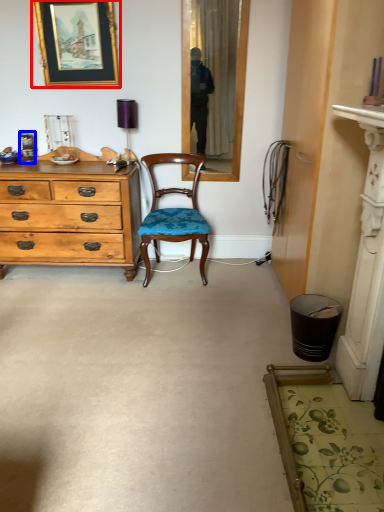
Question: Which object is further to the camera taking this photo, picture frame (highlighted by a red box) or bottle (highlighted by a blue box)?

Choices:
 (A) picture frame
 (B) bottle

Answer: (B)